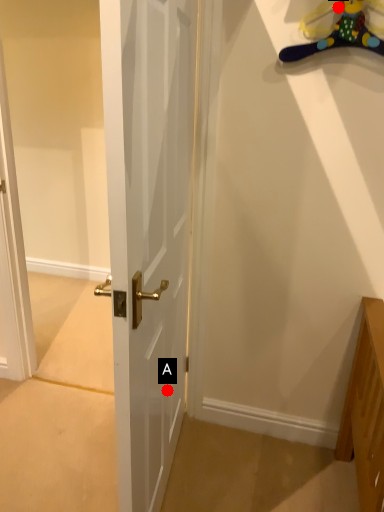
Question: Two points are circled on the image, labeled by A and B beside each circle. Which point is closer to the camera?

Choices:
 (A) A is closer
 (B) B is closer

Answer: (B)